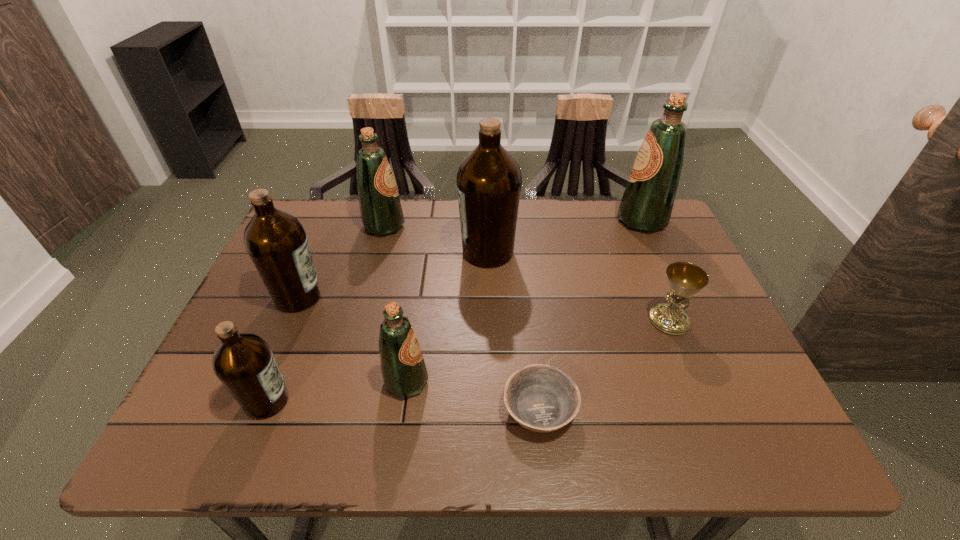
Identify the location of object located in the far right corner section of the desktop. The width and height of the screenshot is (960, 540). (647, 202).

In the image, there is a desktop. In order to click on vacant space at the far edge in this screenshot , I will do `click(523, 233)`.

Image resolution: width=960 pixels, height=540 pixels. In the image, there is a desktop. In order to click on vacant area at the near edge in this screenshot , I will do `click(340, 456)`.

Find the location of a particular element. The width and height of the screenshot is (960, 540). free location at the left edge of the desktop is located at coordinates (301, 328).

In the image, there is a desktop. Where is `vacant area at the right edge`? vacant area at the right edge is located at coordinates (734, 373).

Image resolution: width=960 pixels, height=540 pixels. I want to click on vacant space at the far left corner, so click(x=335, y=213).

I want to click on blank space at the far right corner of the desktop, so click(664, 239).

Identify the location of vacant region between the nearest brown olive oil and the second farthest brown olive oil. The width and height of the screenshot is (960, 540). 282,349.

Find the location of a particular element. The height and width of the screenshot is (540, 960). empty location between the leftmost green olive oil and the smallest brown olive oil is located at coordinates (325, 313).

At what (x,y) coordinates should I click in order to perform the action: click on unoccupied position between the third olive oil from right to left and the smallest brown olive oil. Please return your answer as a coordinate pair (x, y). Image resolution: width=960 pixels, height=540 pixels. Looking at the image, I should click on (337, 392).